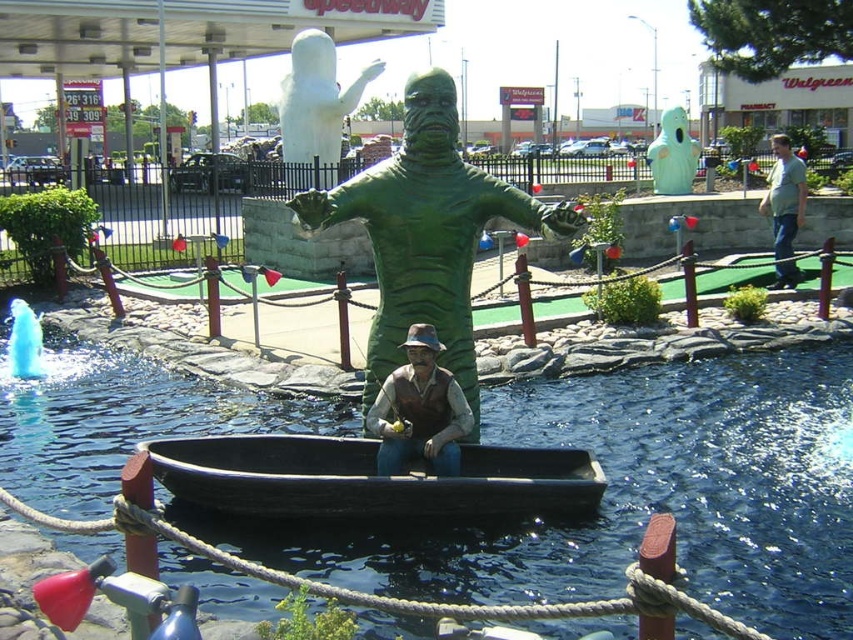
Is point (728, 602) closer to camera compared to point (440, 348)?

Yes, point (728, 602) is closer to viewer.

Does black rubber boat at center appear over matte brown vest at center?

No.

Is point (444, 584) positioned behind point (434, 381)?

No, it is in front of (434, 381).

Locate an element on the screen. black rubber boat at center is located at coordinates (630, 497).

Does green rubber statue at center appear on the right side of black wood canoe at center?

Correct, you'll find green rubber statue at center to the right of black wood canoe at center.

Who is lower down, green rubber statue at center or black wood canoe at center?

black wood canoe at center

The image size is (853, 640). What are the coordinates of `green rubber statue at center` in the screenshot? It's located at (426, 234).

Is the position of white matte ghost at upper center more distant than that of teal rubber ghost at center?

That is False.

Does white matte ghost at upper center appear under teal rubber ghost at center?

Incorrect, white matte ghost at upper center is not positioned below teal rubber ghost at center.

What do you see at coordinates (316, 99) in the screenshot? I see `white matte ghost at upper center` at bounding box center [316, 99].

The width and height of the screenshot is (853, 640). Find the location of `white matte ghost at upper center`. white matte ghost at upper center is located at coordinates (316, 99).